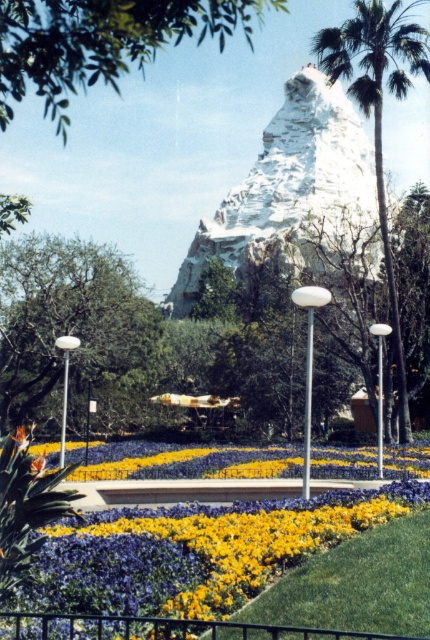
You are a visitor in the park and want to take a photo of both the green leafy tree at upper center and the green leafy palm tree at upper right. Can you position yourself so that both trees are visible in the same frame without one blocking the other?

The green leafy tree at upper center is in front of the green leafy palm tree at upper right, so you cannot position yourself to see both trees without one blocking the other.

You are a visitor at the park and want to take a photo of both the yellow matte flower bed at center and the green leafy tree at upper center in the same frame. Based on their heights, which object should you position closer to the camera to ensure both are fully visible?

The yellow matte flower bed at center is shorter than the green leafy tree at upper center. To capture both in the same frame, position the shorter flower bed closer to the camera so that the taller tree can be seen in the background without being cut off.

You are standing at point A located at coordinates point A at (276,193). You need to walk to point B which is 140.70 meters away. Is there a direct path between the two points without any obstacles?

Yes, there is a direct path between point A at (276,193) and point B since the distance is 140.70 meters and there are no obstacles mentioned in the scene description.